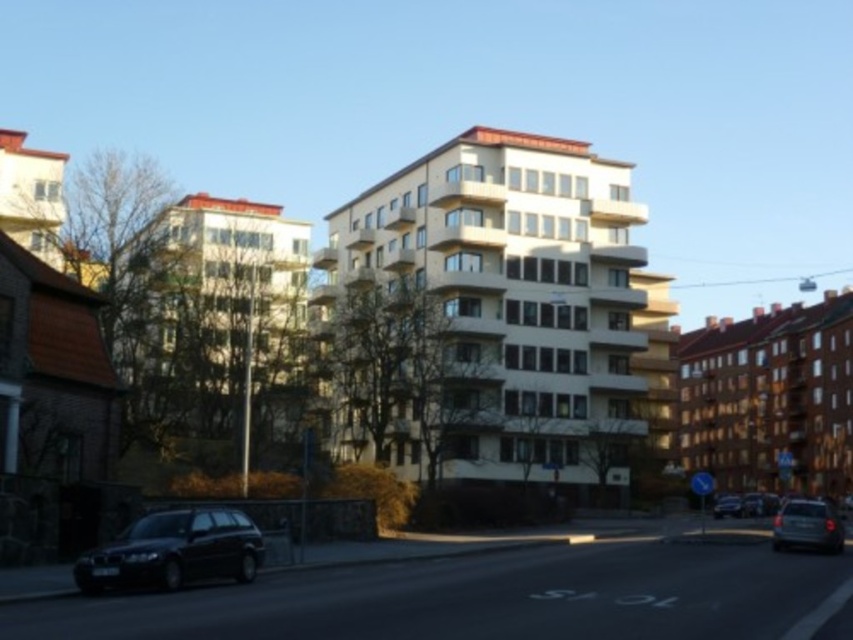
You are standing at the point labeled point (252, 531) and want to walk to the point labeled point (721, 500). Which direction should you move in to reach your destination?

You should move downward and to the left to reach point (721, 500) from point (252, 531).

You are a delivery person trying to park your van between the shiny black car at lower left and the metallic silver suv at lower right. Based on the scene, can you fit your van there?

The shiny black car at lower left is thinner than the metallic silver suv at lower right, so the space between them may be too narrow for your van depending on its width. You should measure the distance first before attempting to park.